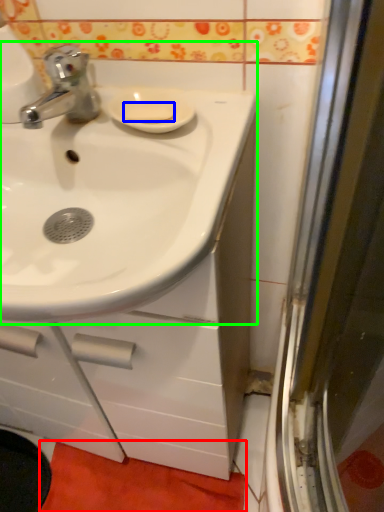
Question: Which object is positioned closest to bath mat (highlighted by a red box)? Select from soap (highlighted by a blue box) and sink (highlighted by a green box).

Choices:
 (A) soap
 (B) sink

Answer: (B)